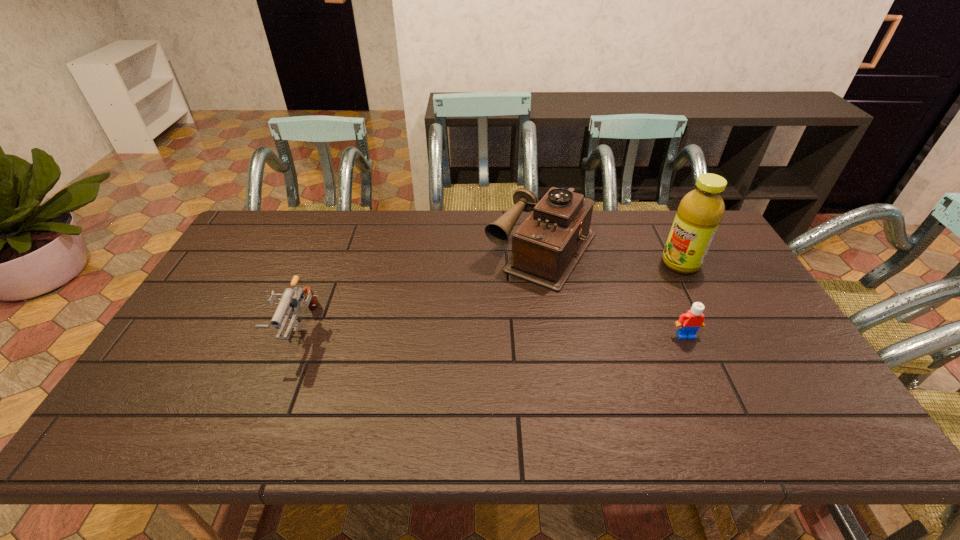
Where is `free space between the tallest object and the Lego`? This screenshot has width=960, height=540. free space between the tallest object and the Lego is located at coordinates (683, 299).

Where is `free space between the third object from right to left and the fruit juice`? The image size is (960, 540). free space between the third object from right to left and the fruit juice is located at coordinates (612, 257).

You are a GUI agent. You are given a task and a screenshot of the screen. Output one action in this format:
    pyautogui.click(x=<x>, y=<y>)
    Task: Click on the free point between the tallest object and the third shortest object
    The height and width of the screenshot is (540, 960).
    Given the screenshot: What is the action you would take?
    pyautogui.click(x=612, y=257)

Locate an element on the screen. This screenshot has width=960, height=540. free spot between the phonograph_record and the Lego is located at coordinates (614, 293).

This screenshot has height=540, width=960. In order to click on vacant space in between the shortest object and the fruit juice in this screenshot , I will do `click(683, 299)`.

Locate an element on the screen. This screenshot has height=540, width=960. free space between the gun and the shortest object is located at coordinates (492, 333).

Where is `vacant area between the Lego and the leftmost object`? The height and width of the screenshot is (540, 960). vacant area between the Lego and the leftmost object is located at coordinates (492, 333).

What are the coordinates of `vacant area that lies between the Lego and the fruit juice` in the screenshot? It's located at (683, 299).

This screenshot has height=540, width=960. I want to click on vacant area that lies between the fruit juice and the gun, so click(x=490, y=296).

Identify which object is the third closest to the leftmost object. Please provide its 2D coordinates. Your answer should be formatted as a tuple, i.e. [(x, y)], where the tuple contains the x and y coordinates of a point satisfying the conditions above.

[(700, 211)]